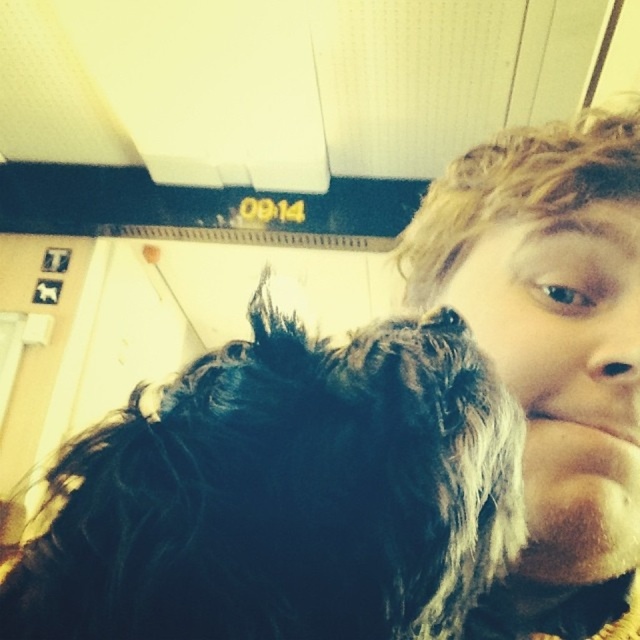
Does curly blonde hair at right lie behind brown matte nose at center?

That is False.

Locate an element on the screen. The image size is (640, 640). curly blonde hair at right is located at coordinates (548, 355).

Between black fuzzy dog at center and brown matte nose at center, which one appears on the left side from the viewer's perspective?

black fuzzy dog at center

The height and width of the screenshot is (640, 640). What do you see at coordinates (285, 496) in the screenshot? I see `black fuzzy dog at center` at bounding box center [285, 496].

This screenshot has width=640, height=640. I want to click on black fuzzy dog at center, so click(285, 496).

Between black fuzzy dog at center and curly blonde hair at right, which one has less height?

With less height is black fuzzy dog at center.

Does black fuzzy dog at center come behind curly blonde hair at right?

No, it is in front of curly blonde hair at right.

This screenshot has height=640, width=640. Identify the location of black fuzzy dog at center. (285, 496).

At what (x,y) coordinates should I click in order to perform the action: click on black fuzzy dog at center. Please return your answer as a coordinate pair (x, y). Looking at the image, I should click on (285, 496).